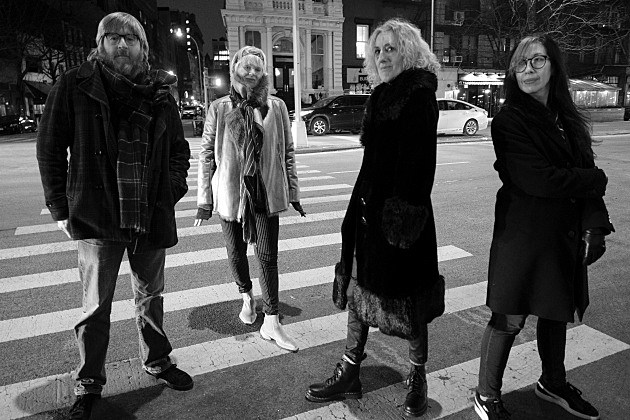
Identify every occurrence of where you push to open the door in the image. Your answer should be formatted as a list of tuples, i.e. [(x1, y1), (x2, y2), ...], where each tuple contains the x and y coordinates of a point satisfying the conditions above.

[(285, 90)]